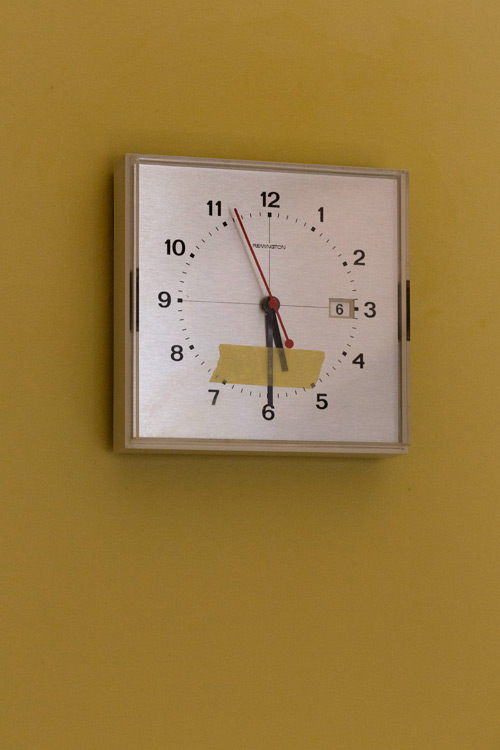
In order to click on frame in this screenshot , I will do `click(121, 438)`.